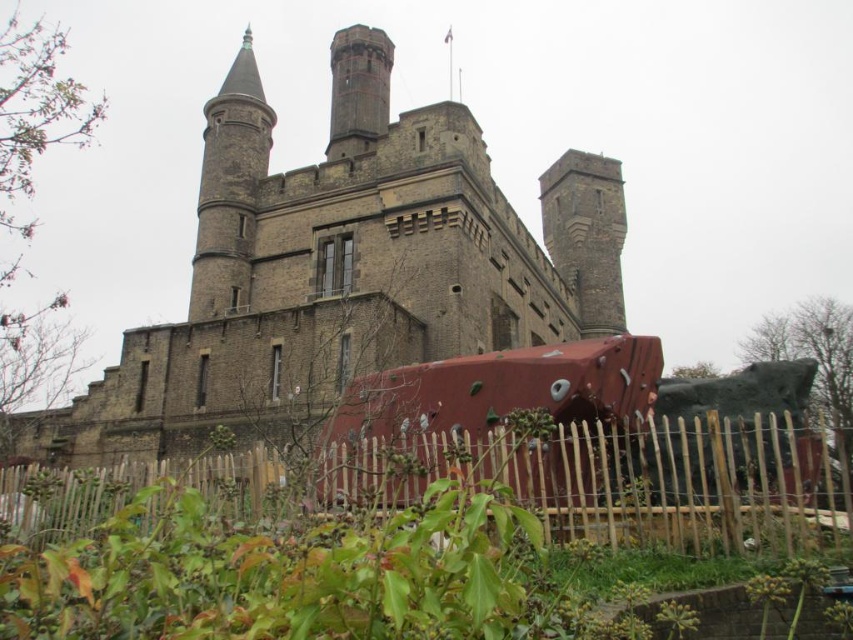
You are standing in front of the historic stone building and want to access the red climbing wall. Which side of the wooden picket fence at lower center should you approach to reach the climbing wall?

The wooden picket fence at lower center is located at point (627, 481), so you should approach the side of the wooden picket fence at lower center that faces the climbing wall to access it.